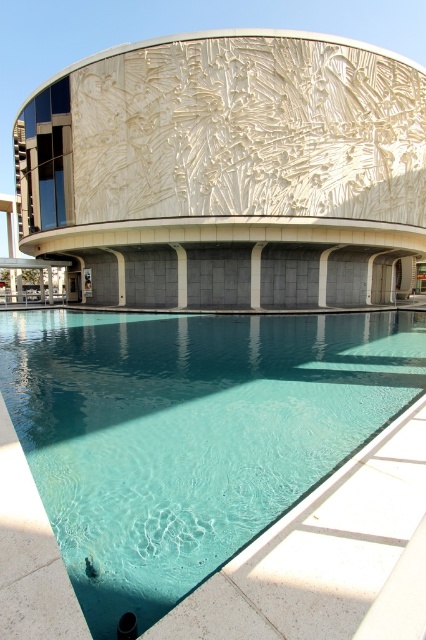
Consider the image. Is clear glass pool at lower center thinner than white textured wall at center?

Yes.

Is point (74, 442) farther from viewer compared to point (357, 241)?

No, it is not.

At what (x,y) coordinates should I click in order to perform the action: click on clear glass pool at lower center. Please return your answer as a coordinate pair (x, y). Image resolution: width=426 pixels, height=640 pixels. Looking at the image, I should click on tap(201, 467).